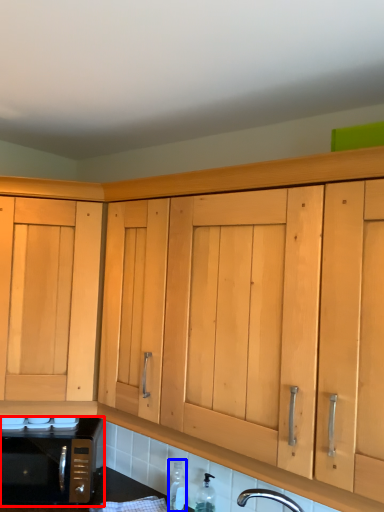
Question: Among these objects, which one is farthest to the camera, microwave oven (highlighted by a red box) or bottle (highlighted by a blue box)?

Choices:
 (A) microwave oven
 (B) bottle

Answer: (A)